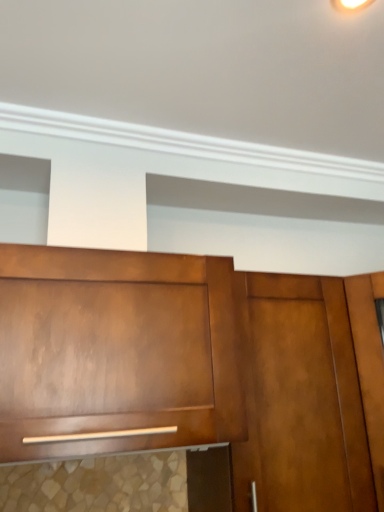
Question: From their relative heights in the image, would you say matte wood cabinet at center is taller or shorter than satin wood door at center?

Choices:
 (A) short
 (B) tall

Answer: (A)

Question: Relative to satin wood door at center, is matte wood cabinet at center in front or behind?

Choices:
 (A) front
 (B) behind

Answer: (A)

Question: Based on their positions, is matte wood cabinet at center located to the left or right of satin wood door at center?

Choices:
 (A) left
 (B) right

Answer: (A)

Question: Considering the positions of satin wood door at center and matte wood cabinet at center in the image, is satin wood door at center bigger or smaller than matte wood cabinet at center?

Choices:
 (A) big
 (B) small

Answer: (B)

Question: In terms of width, does satin wood door at center look wider or thinner when compared to matte wood cabinet at center?

Choices:
 (A) wide
 (B) thin

Answer: (B)

Question: From the image's perspective, is satin wood door at center positioned above or below matte wood cabinet at center?

Choices:
 (A) below
 (B) above

Answer: (A)

Question: Is satin wood door at center to the left or to the right of matte wood cabinet at center in the image?

Choices:
 (A) left
 (B) right

Answer: (B)